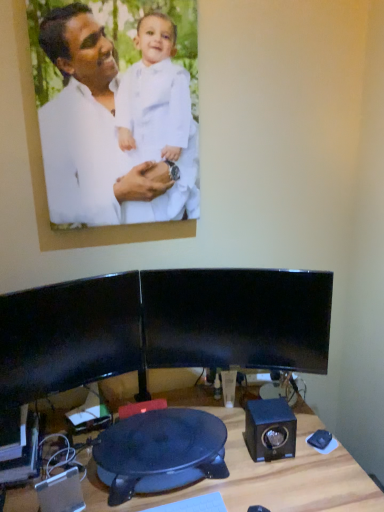
Find the location of a particular element. The image size is (384, 512). vacant location behind blue matte speaker at lower right, which ranks as the second speaker in left-to-right order is located at coordinates (244, 410).